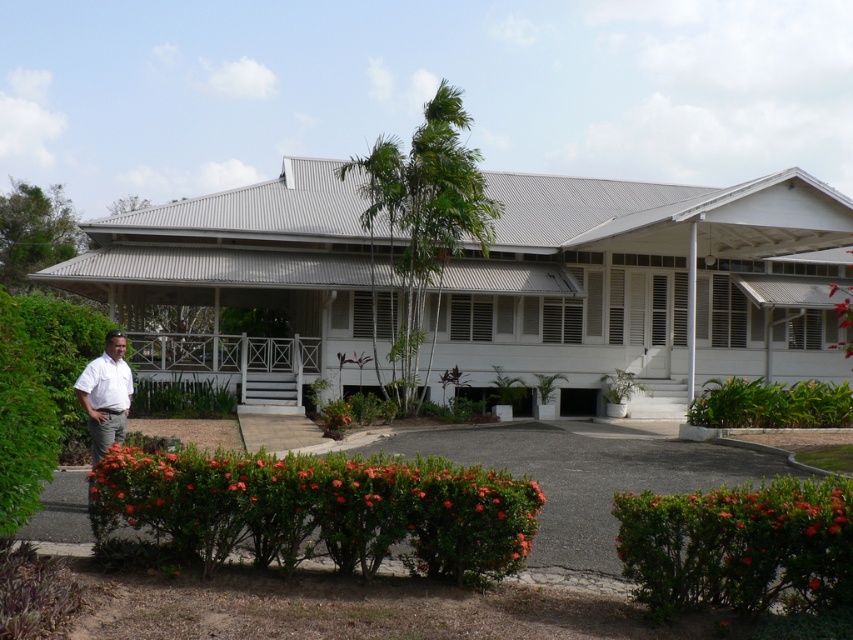
You are standing in front of the two story building and see the white wooden porch at center and the white shirt at left. Which object is positioned more to the left side?

The white shirt at left is positioned more to the left side.

You are a delivery person arriving at the building and need to place a large package on the white wooden porch at center. The package is as wide as the white shirt at left. Will the package fit on the porch without overhanging?

The white wooden porch at center is wider than the white shirt at left, so the package will fit without overhanging.

You are standing at the entrance of the building and looking towards the garden. There are two points marked in the image, point (x=177, y=378) and point (x=93, y=368). Which point is closer to your current position?

Point (x=177, y=378) is further to the camera than point (x=93, y=368), so the point closer to your current position is point (x=93, y=368).